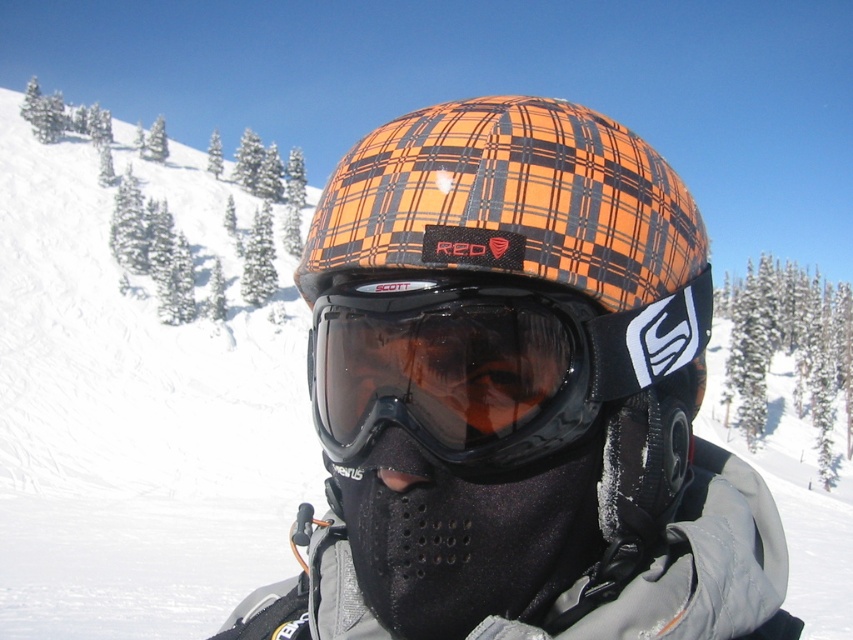
Does orange plaid helmet at center appear over transparent plastic goggles at center?

Yes, orange plaid helmet at center is above transparent plastic goggles at center.

Does point (614, 572) come farther from viewer compared to point (701, 324)?

No.

Identify the location of orange plaid helmet at center. The image size is (853, 640). (502, 364).